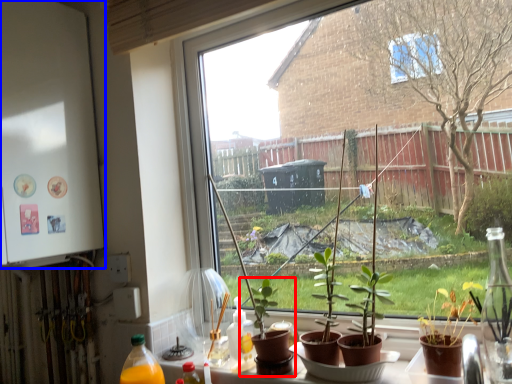
Question: Which object is closer to the camera taking this photo, houseplant (highlighted by a red box) or back (highlighted by a blue box)?

Choices:
 (A) houseplant
 (B) back

Answer: (A)